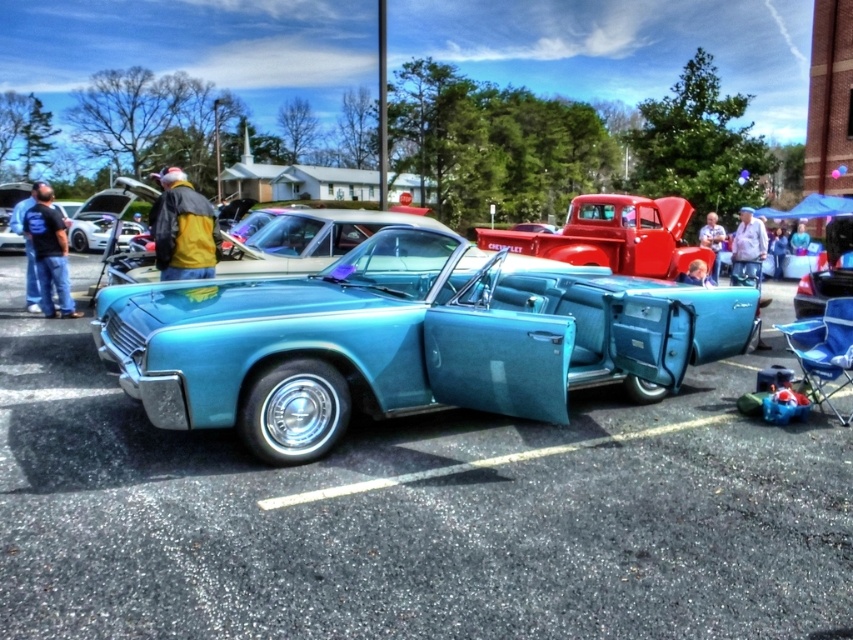
Question: In this image, where is teal leather convertible at center located relative to yellow fabric jacket at upper left?

Choices:
 (A) right
 (B) left

Answer: (A)

Question: Does shiny red truck at center appear on the right side of yellow fabric jacket at upper left?

Choices:
 (A) yes
 (B) no

Answer: (A)

Question: Which of the following is the farthest from the observer?

Choices:
 (A) teal leather convertible at center
 (B) yellow fabric jacket at upper left

Answer: (B)

Question: Which object is positioned farthest from the teal leather convertible at center?

Choices:
 (A) light blue fabric shirt at center
 (B) teal metallic car at center
 (C) dark blue t-shirt at left

Answer: (A)

Question: Which point is closer to the camera taking this photo?

Choices:
 (A) (720, 244)
 (B) (39, 220)
 (C) (146, 444)

Answer: (C)

Question: Can you confirm if teal metallic car at center is positioned above yellow fabric jacket at upper left?

Choices:
 (A) yes
 (B) no

Answer: (B)